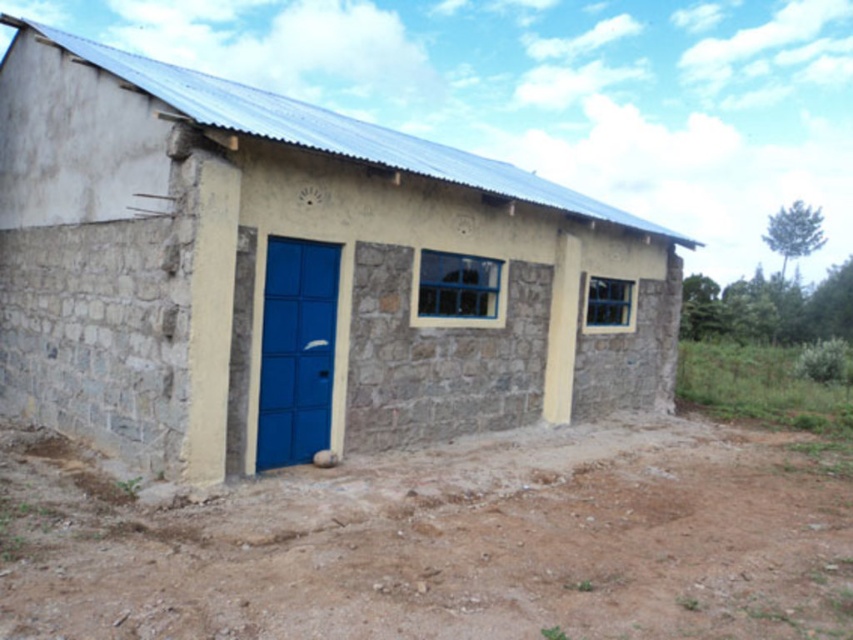
You are standing at the origin point in the image. Where is the smooth concrete hut at center located in terms of coordinates?

The smooth concrete hut at center is located at coordinates point (294,273).